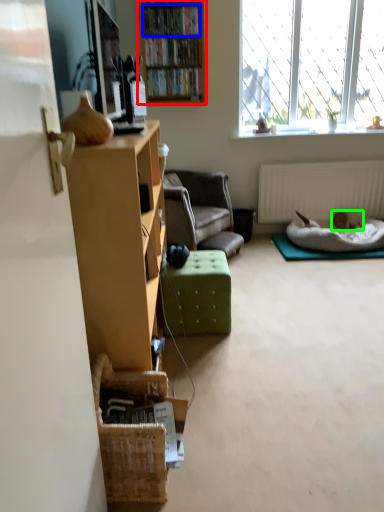
Question: Considering the real-world distances, which object is closest to bookcase (highlighted by a red box)? book (highlighted by a blue box) or animal (highlighted by a green box).

Choices:
 (A) book
 (B) animal

Answer: (A)